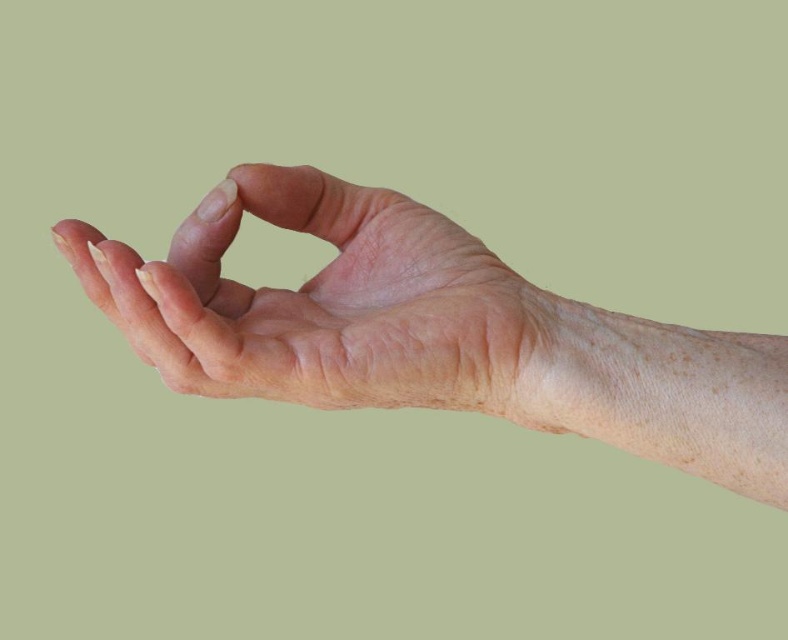
Is dry skin hand at center smaller than smooth skin hand at center?

No.

In the scene shown: Is dry skin hand at center taller than smooth skin hand at center?

Yes.

Who is more forward, [389,397] or [329,403]?

Point [389,397] is in front.

This screenshot has width=788, height=640. Identify the location of dry skin hand at center. (432, 332).